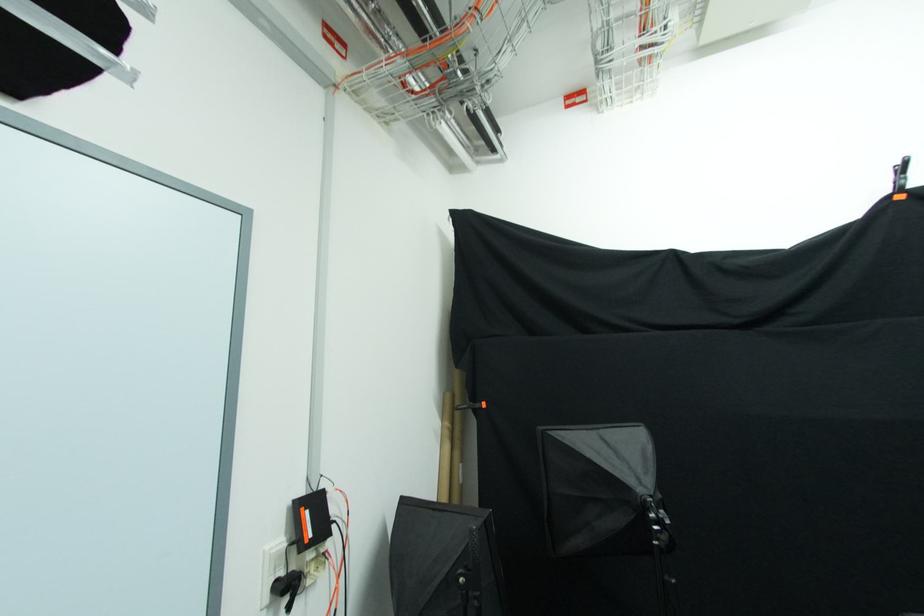
Find the location of a particular element. The width and height of the screenshot is (924, 616). white light switch is located at coordinates (272, 568).